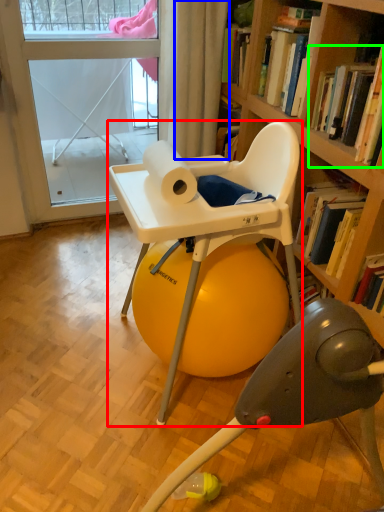
Question: Which object is positioned closest to chair (highlighted by a red box)? Select from curtain (highlighted by a blue box) and book (highlighted by a green box).

Choices:
 (A) curtain
 (B) book

Answer: (B)